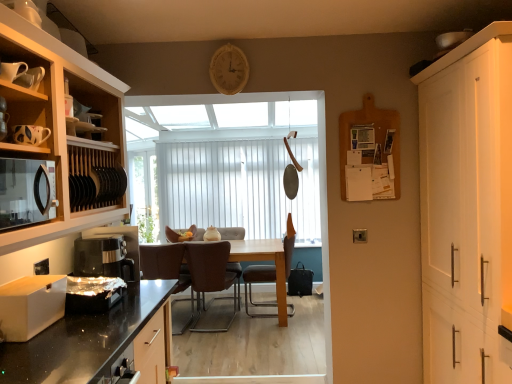
At what (x,y) coordinates should I click in order to perform the action: click on free point below brown leather chair at center, the second chair when ordered from left to right (from a real-world perspective). Please return your answer as a coordinate pair (x, y). Looking at the image, I should click on (227, 301).